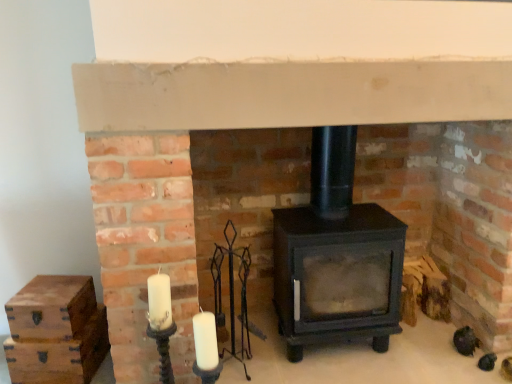
Where is `free space above wooden chest at left, the second drawer when ordered from bottom to top (from a real-world perspective)`? free space above wooden chest at left, the second drawer when ordered from bottom to top (from a real-world perspective) is located at coordinates (45, 292).